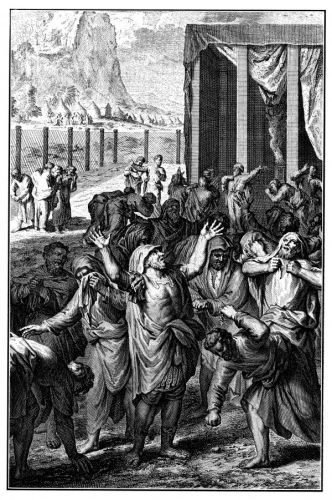
You are a GUI agent. You are given a task and a screenshot of the screen. Output one action in this format:
    pyautogui.click(x=<x>, y=<y>)
    Task: Click on the curtain
    Image resolution: width=332 pixels, height=500 pixels.
    Given the screenshot: What is the action you would take?
    312,72